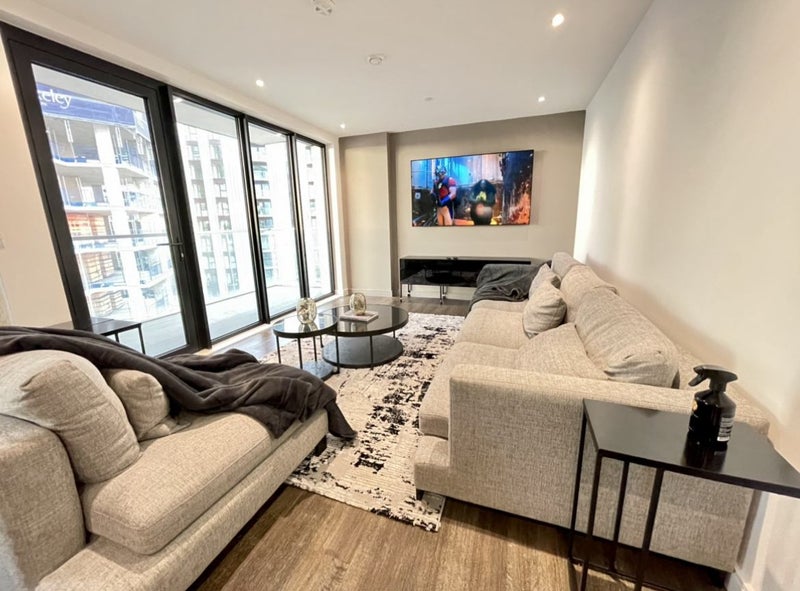
In order to click on rug in this screenshot , I will do `click(436, 513)`.